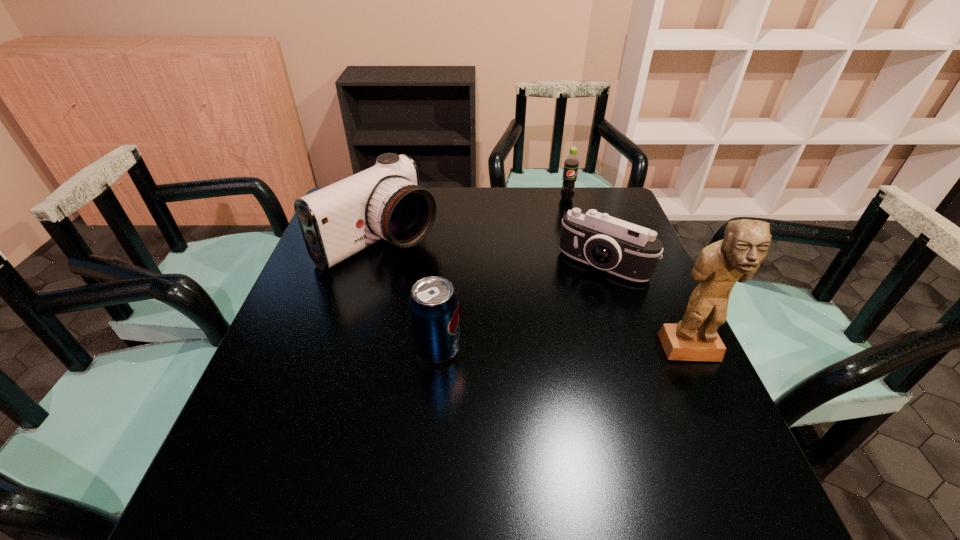
What are the coordinates of `vacant space at the far right corner of the desktop` in the screenshot? It's located at (604, 196).

At what (x,y) coordinates should I click in order to perform the action: click on unoccupied area between the second tallest object and the farthest object. Please return your answer as a coordinate pair (x, y). This screenshot has height=540, width=960. Looking at the image, I should click on (473, 220).

Image resolution: width=960 pixels, height=540 pixels. I want to click on unoccupied position between the farthest object and the second tallest object, so [x=473, y=220].

The width and height of the screenshot is (960, 540). What are the coordinates of `empty space that is in between the camera and the camcorder` in the screenshot? It's located at (492, 253).

Locate an element on the screen. The width and height of the screenshot is (960, 540). vacant space that's between the farthest object and the left soda is located at coordinates (502, 274).

Image resolution: width=960 pixels, height=540 pixels. What are the coordinates of `empty location between the right soda and the nearer soda` in the screenshot? It's located at (502, 274).

I want to click on free point between the figurine and the camcorder, so click(x=535, y=296).

Locate an element on the screen. This screenshot has width=960, height=540. free space that is in between the camera and the nearer soda is located at coordinates (520, 307).

The width and height of the screenshot is (960, 540). Find the location of `free space between the left soda and the farther soda`. free space between the left soda and the farther soda is located at coordinates (502, 274).

This screenshot has height=540, width=960. In order to click on vacant area that lies between the left soda and the right soda in this screenshot , I will do `click(502, 274)`.